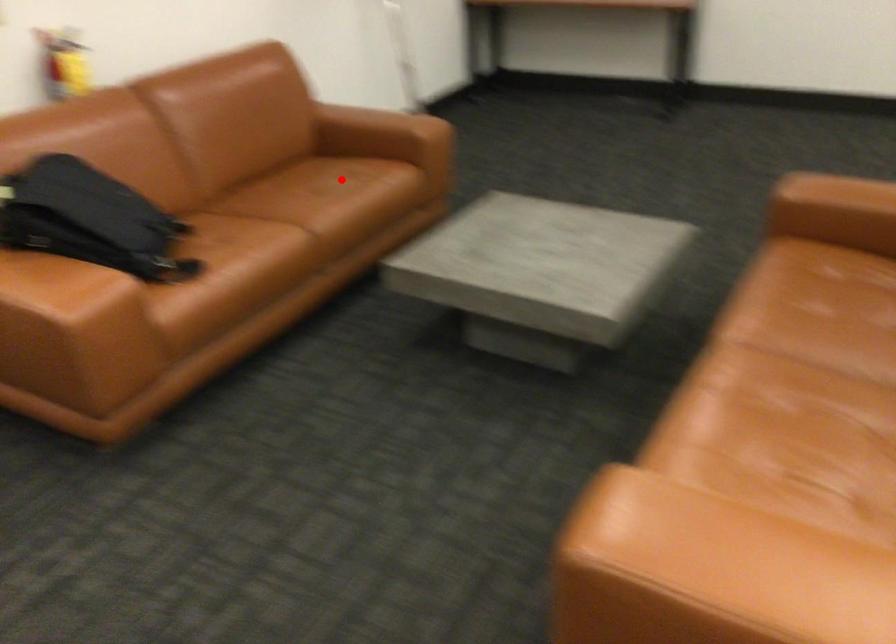
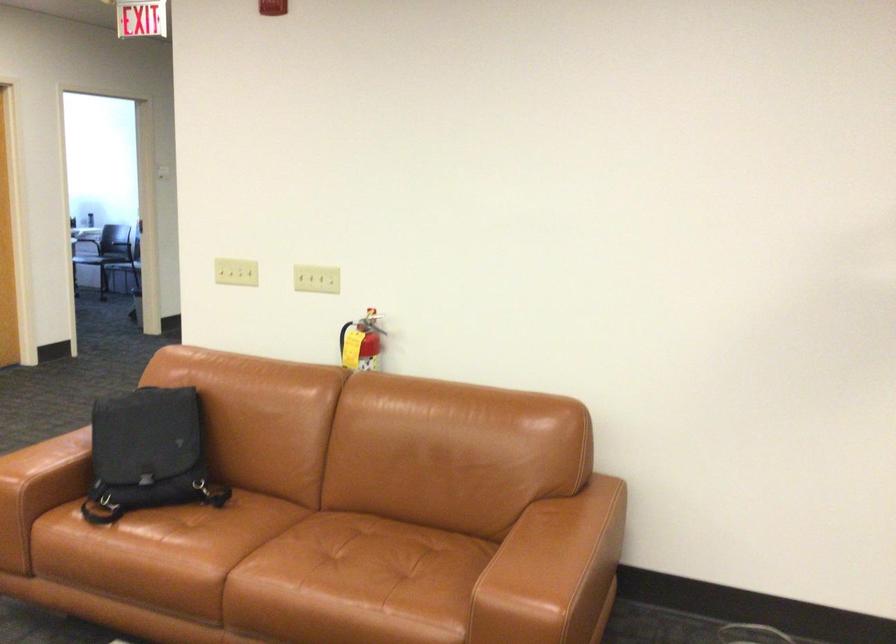
Question: I am providing you with two images of the same scene from different viewpoints. A red point is shown in image1. For the corresponding object point in image2, is it positioned nearer or farther from the camera?

Choices:
 (A) Nearer
 (B) Farther

Answer: (A)